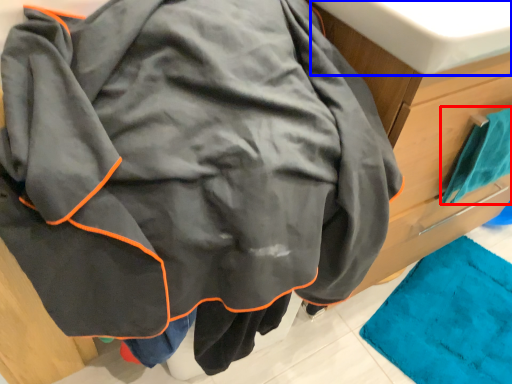
Question: Among these objects, which one is farthest to the camera, towel (highlighted by a red box) or sink (highlighted by a blue box)?

Choices:
 (A) towel
 (B) sink

Answer: (A)